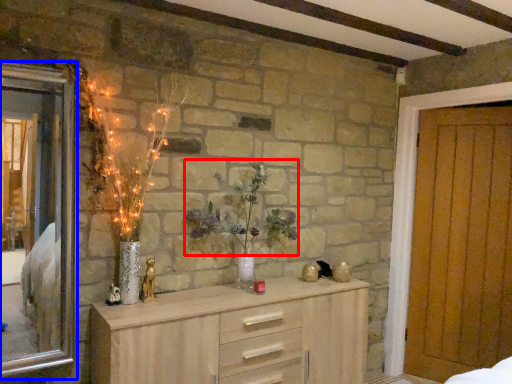
Question: Which object is further to the camera taking this photo, floral arrangement (highlighted by a red box) or window (highlighted by a blue box)?

Choices:
 (A) floral arrangement
 (B) window

Answer: (A)